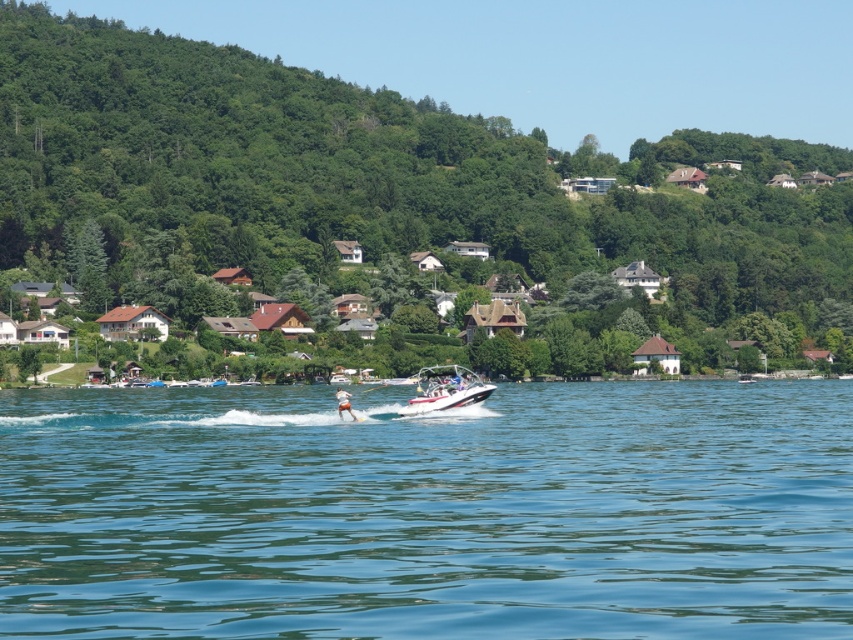
Can you confirm if clear blue water at center is wider than white smooth water skier at center?

Correct, the width of clear blue water at center exceeds that of white smooth water skier at center.

Between point (404, 584) and point (341, 392), which one is positioned in front?

Point (404, 584) is more forward.

Describe the element at coordinates (428, 513) in the screenshot. I see `clear blue water at center` at that location.

Where is `clear blue water at center`? This screenshot has height=640, width=853. clear blue water at center is located at coordinates (428, 513).

Is clear blue water at center above green leafy tree at center?

No, clear blue water at center is not above green leafy tree at center.

From the picture: Does clear blue water at center have a smaller size compared to green leafy tree at center?

Indeed, clear blue water at center has a smaller size compared to green leafy tree at center.

Identify the location of clear blue water at center. (428, 513).

What do you see at coordinates (445, 388) in the screenshot? I see `white glossy speedboat at center` at bounding box center [445, 388].

Is point (451, 372) in front of point (345, 404)?

No, (451, 372) is further to viewer.

Is point (473, 378) behind point (338, 410)?

That is True.

This screenshot has height=640, width=853. I want to click on white glossy speedboat at center, so click(445, 388).